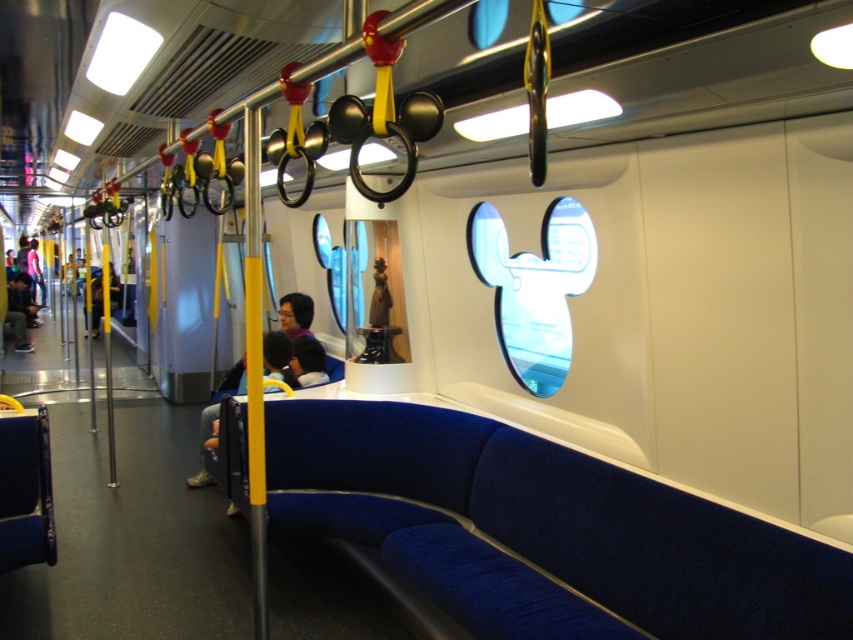
You are a passenger on the Disney train and you want to sit down. There is a blue fabric seat at center and a matte blue pants at center. Which object should you interact with to sit?

The blue fabric seat at center is in front of matte blue pants at center, so you should sit on the blue fabric seat at center.

You are a passenger on the Disney train and want to sit down. You see the blue fabric seat at center and the matte black jacket at left. Which one is closer to you if you are standing at the entrance of the carriage?

The blue fabric seat at center is closer to you because it is in front of the matte black jacket at left, meaning it is nearer to the entrance.

You are standing in the Disney train carriage and want to reach both the point at coordinates (204, 435) and the point at coordinates (26, 280). Which point should you move toward first to reach the closer one?

You should move toward point (204, 435) first because it is closer to you than point (26, 280).